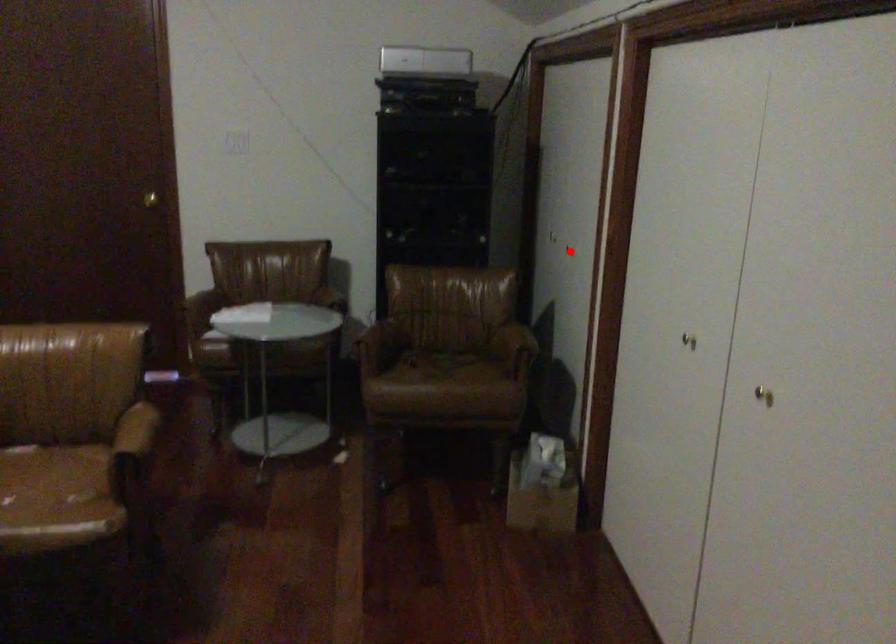
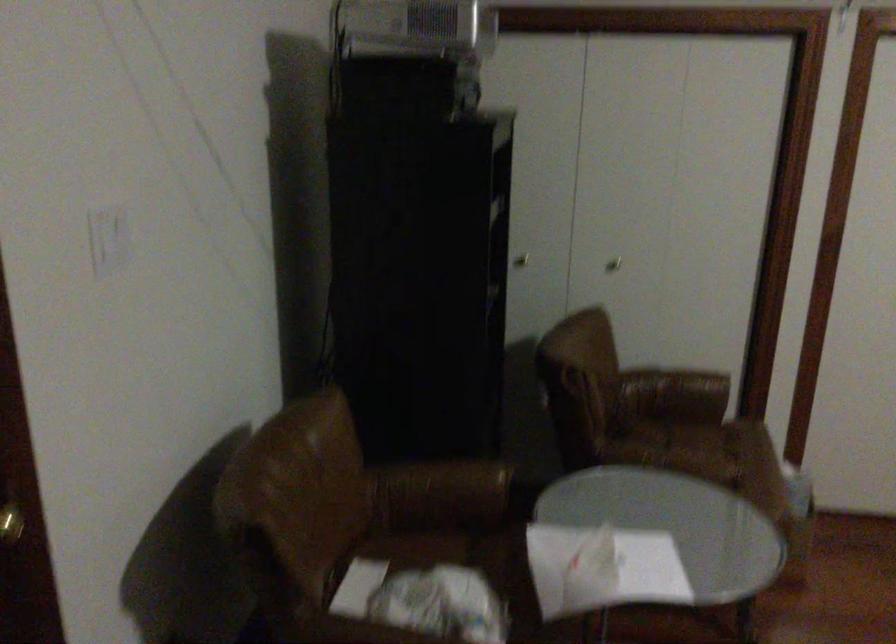
Question: I am providing you with two images of the same scene from different viewpoints. Image1 has a red point marked. In image2, the corresponding 3D location appears at what relative position? Reply with the corresponding letter.

Choices:
 (A) Closer
 (B) Farther

Answer: (A)